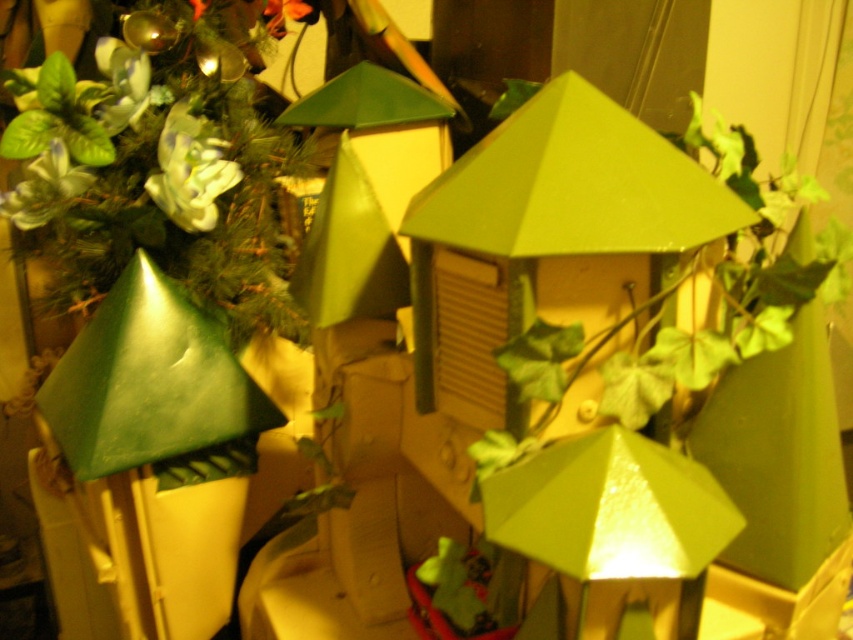
Between point (180, 252) and point (509, 540), which one is positioned in front?

Point (509, 540) is in front.

Can you confirm if green matte plant at left is bigger than matte green lamp at center?

Correct, green matte plant at left is larger in size than matte green lamp at center.

The height and width of the screenshot is (640, 853). In order to click on green matte plant at left in this screenshot , I will do `click(158, 170)`.

You are a GUI agent. You are given a task and a screenshot of the screen. Output one action in this format:
    pyautogui.click(x=<x>, y=<y>)
    Task: Click on the green matte plant at left
    
    Given the screenshot: What is the action you would take?
    pyautogui.click(x=158, y=170)